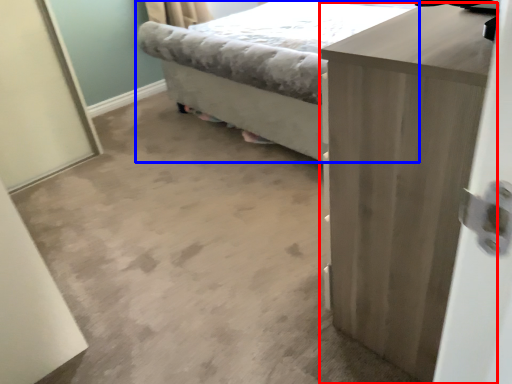
Question: Which point is closer to the camera, chest of drawers (highlighted by a red box) or bed (highlighted by a blue box)?

Choices:
 (A) chest of drawers
 (B) bed

Answer: (A)